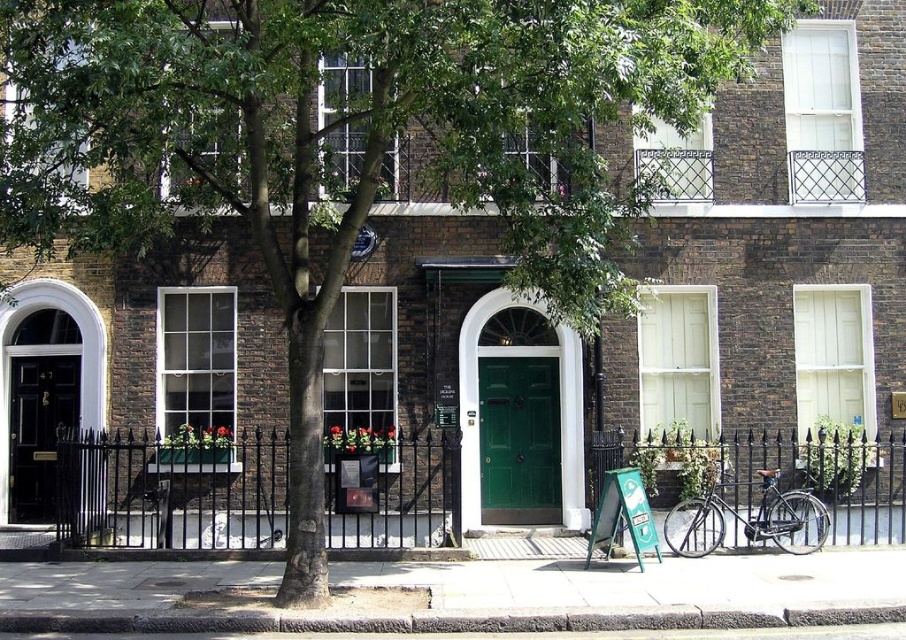
You are standing in the middle of the street looking at the row of townhouses. There is a point marked at coordinates [519,440]. Which object does this point correspond to?

The point at coordinates [519,440] corresponds to the green matte door at center.

You are a delivery person trying to deliver a package to the green matte door at center. However, there is a shiny black bicycle at lower right blocking the path. Can you estimate if the bicycle is larger than the door?

The green matte door at center is smaller than the shiny black bicycle at lower right, so the bicycle is larger and may be blocking the path.

You are a delivery person trying to decide whether to park your shiny black bicycle at lower right near the black glossy door at left. Considering their heights, which one is taller and would allow enough clearance for the bicycle?

The black glossy door at left is taller than the shiny black bicycle at lower right, so parking the bicycle near the door would provide sufficient clearance since the door is taller.